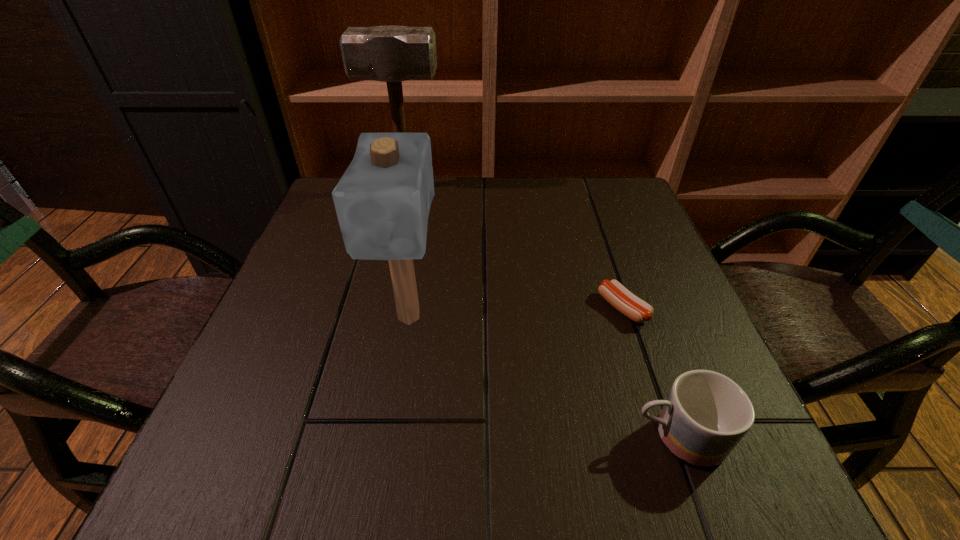
In order to click on the farther mallet in this screenshot , I will do `click(392, 54)`.

At what (x,y) coordinates should I click in order to perform the action: click on the nearer mallet. Please return your answer as a coordinate pair (x, y). Looking at the image, I should click on (382, 201).

What are the coordinates of `the nearest object` in the screenshot? It's located at (706, 414).

Find the location of a particular element. The height and width of the screenshot is (540, 960). mug is located at coordinates (706, 414).

This screenshot has width=960, height=540. I want to click on sausage, so click(x=624, y=301).

Locate an element on the screen. The image size is (960, 540). vacant space located on the striking face of the farther mallet is located at coordinates (550, 187).

You are a GUI agent. You are given a task and a screenshot of the screen. Output one action in this format:
    pyautogui.click(x=<x>, y=<y>)
    Task: Click on the free space located 0.120m on the left of the nearer mallet
    The image size is (960, 540).
    Given the screenshot: What is the action you would take?
    coord(316,318)

Where is `free space located on the side with the handle of the mug`? The height and width of the screenshot is (540, 960). free space located on the side with the handle of the mug is located at coordinates (537, 437).

Where is `vacant space located 0.070m on the side with the handle of the mug`? The image size is (960, 540). vacant space located 0.070m on the side with the handle of the mug is located at coordinates (584, 437).

Identify the location of blank space located 0.350m on the side with the handle of the mug. (396, 437).